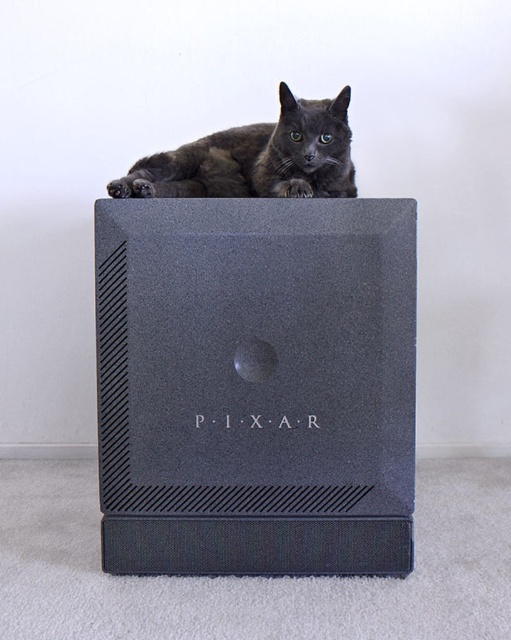
How distant is matte black speaker at center from shiny black cat at upper center?

matte black speaker at center and shiny black cat at upper center are 10.65 inches apart.

Which is in front, point (125, 324) or point (284, 84)?

Point (125, 324) is in front.

Between point (203, 211) and point (168, 180), which one is positioned behind?

Positioned behind is point (168, 180).

The height and width of the screenshot is (640, 511). Find the location of `matte black speaker at center`. matte black speaker at center is located at coordinates (256, 385).